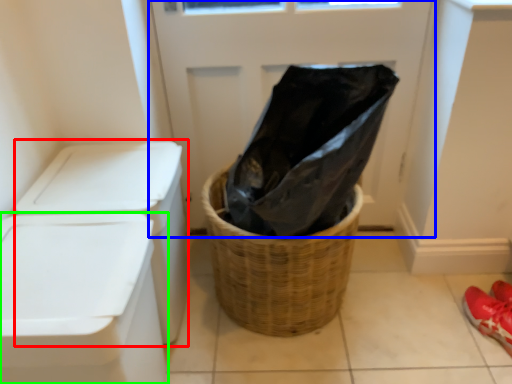
Question: Which object is positioned farthest from washer (highlighted by a red box)? Select from screen door (highlighted by a blue box) and waste container (highlighted by a green box).

Choices:
 (A) screen door
 (B) waste container

Answer: (A)